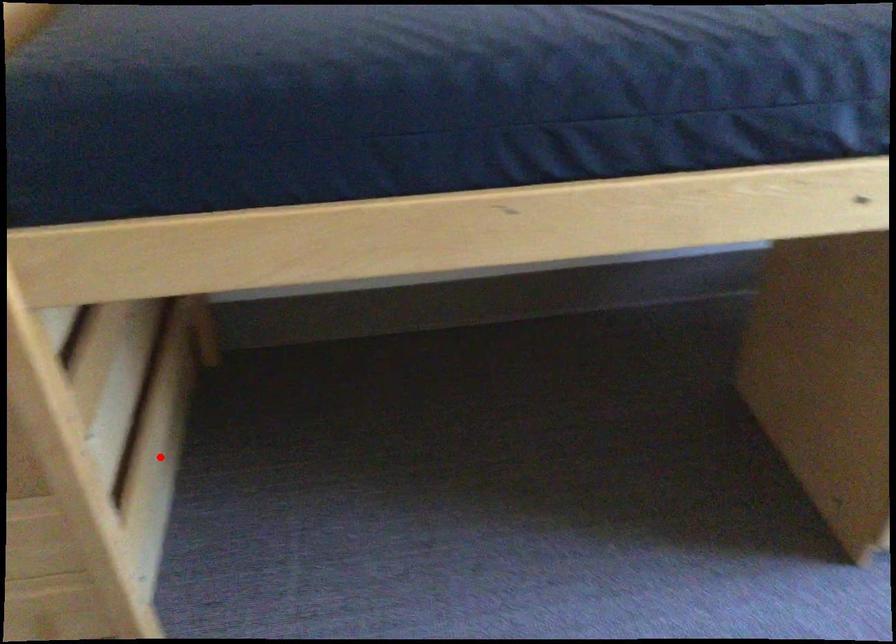
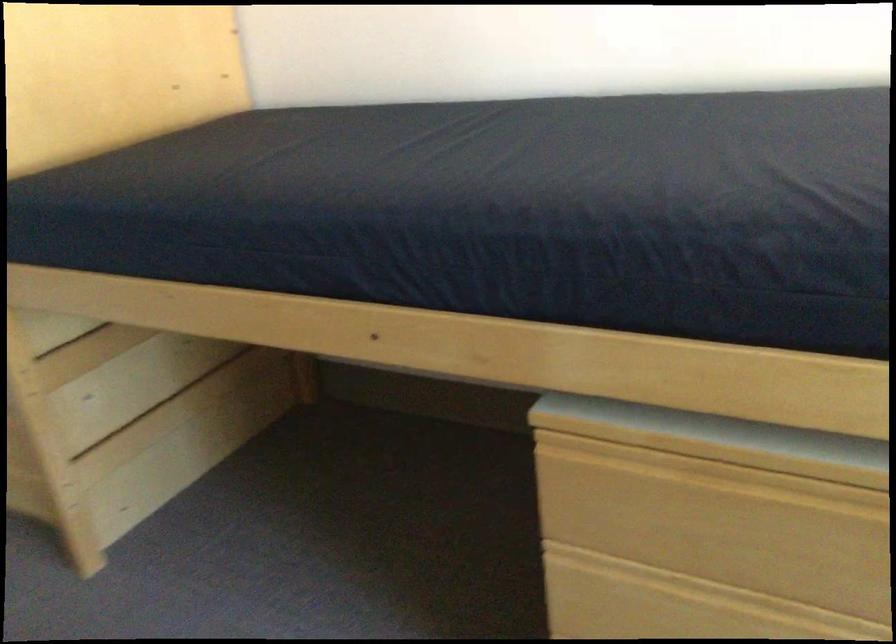
Question: A red point is marked in image1. In image2, is the corresponding 3D point closer to the camera or farther? Reply with the corresponding letter.

Choices:
 (A) The corresponding 3D point is closer.
 (B) The corresponding 3D point is farther.

Answer: (B)